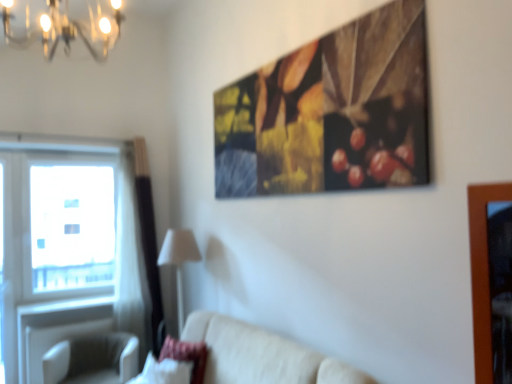
Question: Is metallic chandelier at upper left not close to white fabric lampshade at lower center?

Choices:
 (A) yes
 (B) no

Answer: (A)

Question: Is metallic chandelier at upper left to the right of white fabric lampshade at lower center from the viewer's perspective?

Choices:
 (A) yes
 (B) no

Answer: (B)

Question: From the image's perspective, is metallic chandelier at upper left on white fabric lampshade at lower center?

Choices:
 (A) no
 (B) yes

Answer: (B)

Question: Does metallic chandelier at upper left have a lesser height compared to white fabric lampshade at lower center?

Choices:
 (A) yes
 (B) no

Answer: (A)

Question: Is metallic chandelier at upper left aimed at white fabric lampshade at lower center?

Choices:
 (A) yes
 (B) no

Answer: (B)

Question: Is metallic chandelier at upper left next to white fabric lampshade at lower center and touching it?

Choices:
 (A) no
 (B) yes

Answer: (A)

Question: Is white fabric lampshade at lower center oriented away from transparent glass window at left?

Choices:
 (A) no
 (B) yes

Answer: (A)

Question: Is white fabric lampshade at lower center thinner than transparent glass window at left?

Choices:
 (A) yes
 (B) no

Answer: (B)

Question: Is white fabric lampshade at lower center not within transparent glass window at left?

Choices:
 (A) yes
 (B) no

Answer: (A)

Question: Is the surface of white fabric lampshade at lower center in direct contact with transparent glass window at left?

Choices:
 (A) no
 (B) yes

Answer: (A)

Question: Is the depth of white fabric lampshade at lower center less than that of transparent glass window at left?

Choices:
 (A) no
 (B) yes

Answer: (B)

Question: Does white fabric lampshade at lower center appear on the left side of transparent glass window at left?

Choices:
 (A) no
 (B) yes

Answer: (A)

Question: Is beige fabric couch at lower center completely or partially outside of transparent glass window at left?

Choices:
 (A) no
 (B) yes

Answer: (B)